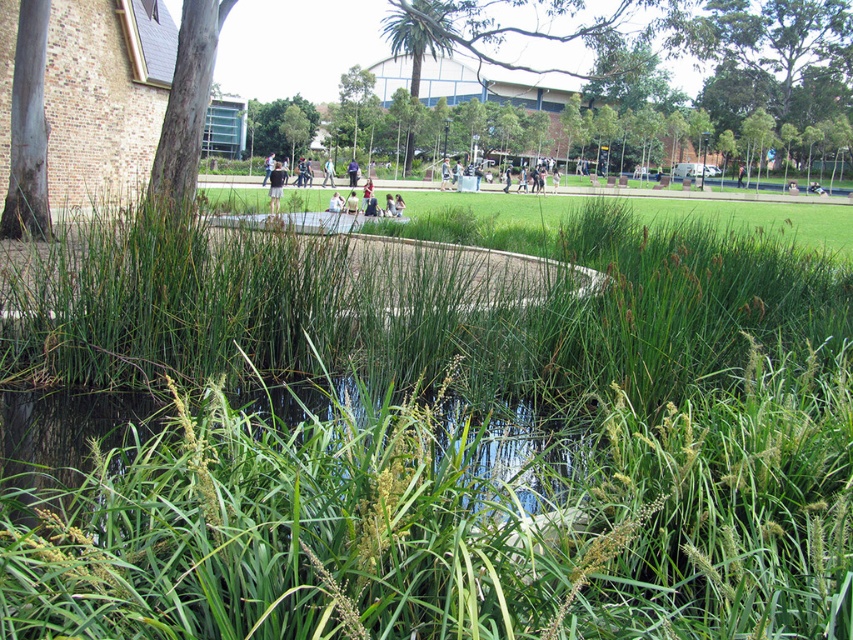
You are a photographer standing at the edge of the water feature. You notice the green grass at center and the dark blue jeans at center in your viewfinder. Which object is closer to the water feature?

The green grass at center is closer to the water feature because it is positioned below the dark blue jeans at center, indicating it is lower in elevation.